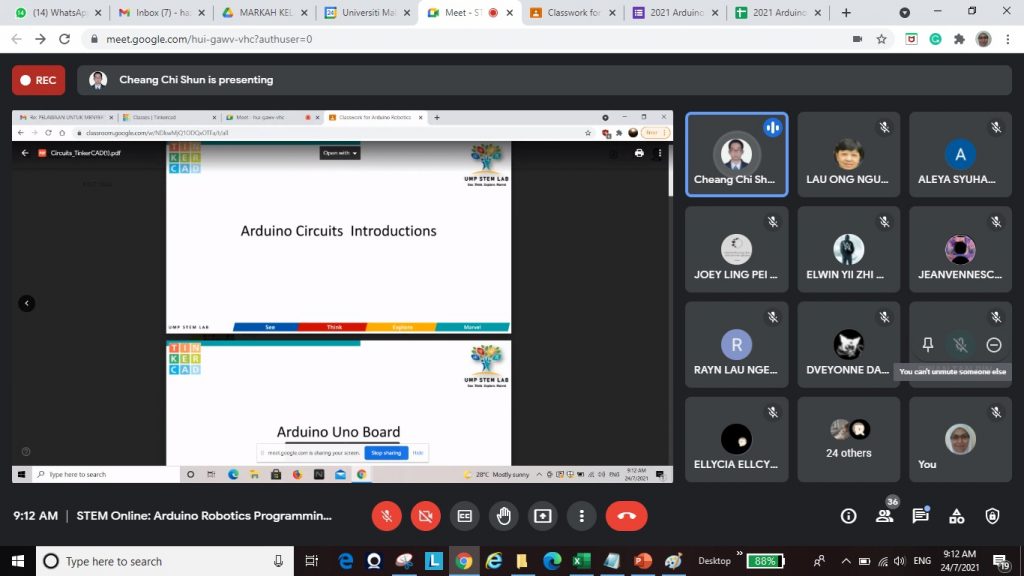
Where is `meeting control buttons`? This screenshot has height=576, width=1024. meeting control buttons is located at coordinates (42, 557), (379, 515), (419, 518), (459, 509), (478, 515), (499, 515), (538, 511), (575, 510), (638, 520).